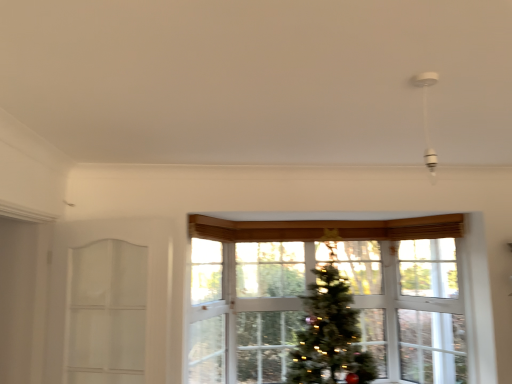
Question: Is white glass door at left shorter than clear glass window at center?

Choices:
 (A) yes
 (B) no

Answer: (A)

Question: Is white glass door at left positioned far away from clear glass window at center?

Choices:
 (A) yes
 (B) no

Answer: (A)

Question: Considering the relative positions of white glass door at left and clear glass window at center in the image provided, is white glass door at left behind clear glass window at center?

Choices:
 (A) no
 (B) yes

Answer: (A)

Question: Does white glass door at left appear on the right side of clear glass window at center?

Choices:
 (A) no
 (B) yes

Answer: (A)

Question: From a real-world perspective, is white glass door at left over clear glass window at center?

Choices:
 (A) no
 (B) yes

Answer: (B)

Question: From a real-world perspective, is white glass door at left beneath clear glass window at center?

Choices:
 (A) yes
 (B) no

Answer: (B)

Question: Does clear glass window at center have a lesser height compared to white glass door at left?

Choices:
 (A) no
 (B) yes

Answer: (A)

Question: Is clear glass window at center not near white glass door at left?

Choices:
 (A) yes
 (B) no

Answer: (A)

Question: Is clear glass window at center located outside white glass door at left?

Choices:
 (A) yes
 (B) no

Answer: (A)

Question: From a real-world perspective, is clear glass window at center on white glass door at left?

Choices:
 (A) yes
 (B) no

Answer: (B)

Question: Is clear glass window at center oriented towards white glass door at left?

Choices:
 (A) yes
 (B) no

Answer: (B)

Question: Can you confirm if clear glass window at center is bigger than white glass door at left?

Choices:
 (A) no
 (B) yes

Answer: (B)

Question: Looking at their shapes, would you say white glass door at left is wider or thinner than clear glass window at center?

Choices:
 (A) wide
 (B) thin

Answer: (B)